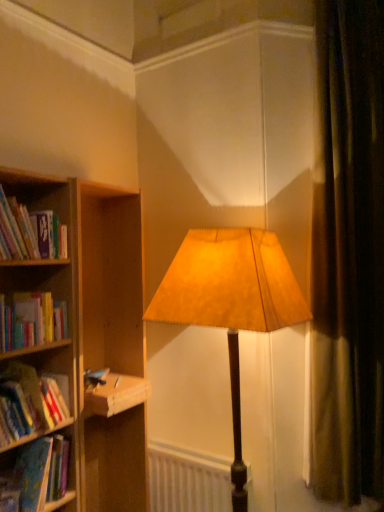
Question: Is white matte radiator at lower center shorter than suede-like beige lampshade at center?

Choices:
 (A) yes
 (B) no

Answer: (A)

Question: Is white matte radiator at lower center facing away from suede-like beige lampshade at center?

Choices:
 (A) no
 (B) yes

Answer: (A)

Question: Is white matte radiator at lower center far away from suede-like beige lampshade at center?

Choices:
 (A) no
 (B) yes

Answer: (A)

Question: From a real-world perspective, is white matte radiator at lower center positioned under suede-like beige lampshade at center based on gravity?

Choices:
 (A) no
 (B) yes

Answer: (B)

Question: From the image's perspective, does white matte radiator at lower center appear higher than suede-like beige lampshade at center?

Choices:
 (A) yes
 (B) no

Answer: (B)

Question: Does white matte radiator at lower center have a lesser width compared to suede-like beige lampshade at center?

Choices:
 (A) yes
 (B) no

Answer: (A)

Question: Does hardcover book at left turn towards hardcover book at left, the 3th book positioned from the bottom?

Choices:
 (A) no
 (B) yes

Answer: (A)

Question: Is hardcover book at left not inside hardcover book at left, which is the 2th book from top to bottom?

Choices:
 (A) yes
 (B) no

Answer: (A)

Question: Does hardcover book at left have a smaller size compared to hardcover book at left, the 3th book positioned from the bottom?

Choices:
 (A) no
 (B) yes

Answer: (B)

Question: Is hardcover book at left wider than hardcover book at left, the 3th book positioned from the bottom?

Choices:
 (A) yes
 (B) no

Answer: (A)

Question: Can you confirm if hardcover book at left is bigger than hardcover book at left, the 3th book positioned from the bottom?

Choices:
 (A) no
 (B) yes

Answer: (A)

Question: Is hardcover book at left far away from hardcover book at left, which is the 2th book from top to bottom?

Choices:
 (A) yes
 (B) no

Answer: (B)

Question: Is hardcover book at left completely or partially outside of hardcover book at left, which ranks as the 1th book in top-to-bottom order?

Choices:
 (A) yes
 (B) no

Answer: (A)